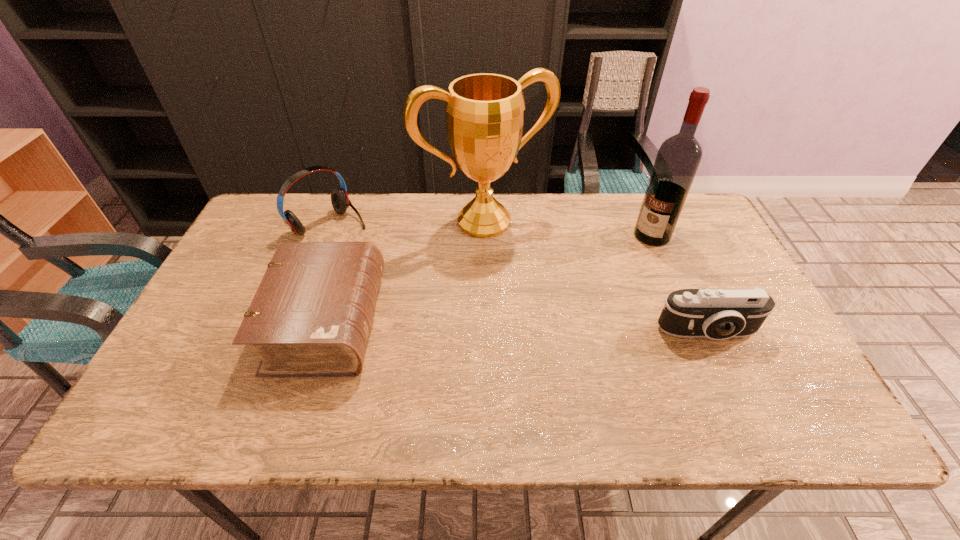
Image resolution: width=960 pixels, height=540 pixels. In order to click on object that is positioned at the left edge in this screenshot , I will do `click(340, 201)`.

Image resolution: width=960 pixels, height=540 pixels. Identify the location of camera present at the right edge. coord(718,314).

Locate an element on the screen. alcohol located in the right edge section of the desktop is located at coordinates pos(678,158).

In order to click on object situated at the far left corner in this screenshot , I will do `click(340, 201)`.

What are the coordinates of `object located in the far right corner section of the desktop` in the screenshot? It's located at (678, 158).

Image resolution: width=960 pixels, height=540 pixels. I want to click on vacant space at the far edge, so click(x=364, y=195).

In the image, there is a desktop. What are the coordinates of `vacant space at the near edge` in the screenshot? It's located at (434, 373).

In the image, there is a desktop. At what (x,y) coordinates should I click in order to perform the action: click on vacant space at the right edge. Please return your answer as a coordinate pair (x, y). Looking at the image, I should click on (700, 270).

Locate an element on the screen. The image size is (960, 540). vacant area at the far left corner of the desktop is located at coordinates (271, 195).

Locate an element on the screen. free location at the near right corner is located at coordinates (786, 360).